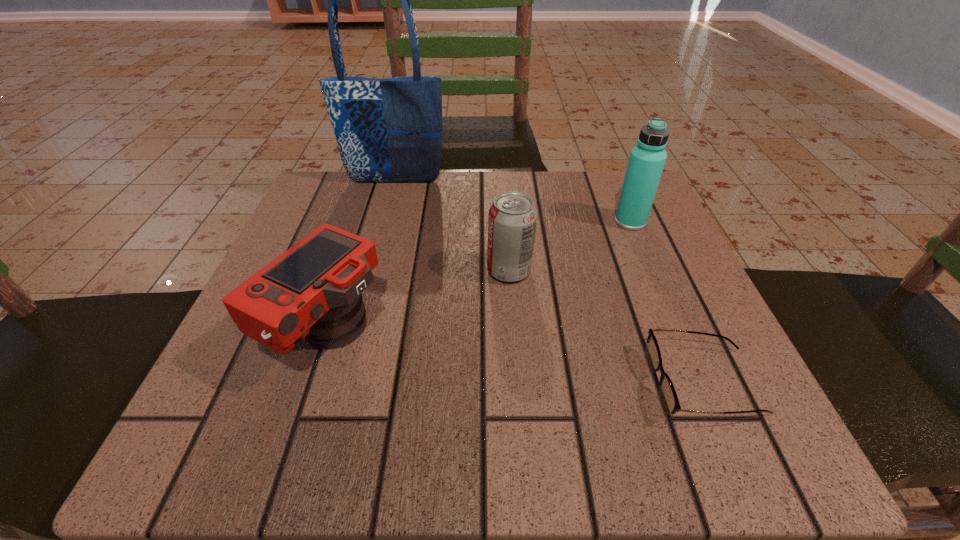
Find the location of a particular element. The image size is (960, 540). the farthest object is located at coordinates (388, 130).

In order to click on the tallest object in this screenshot , I will do `click(388, 130)`.

The width and height of the screenshot is (960, 540). Identify the location of the second farthest object. (647, 159).

The height and width of the screenshot is (540, 960). What are the coordinates of `thermos bottle` in the screenshot? It's located at (647, 159).

Image resolution: width=960 pixels, height=540 pixels. Identify the location of soda can. (512, 219).

You are a GUI agent. You are given a task and a screenshot of the screen. Output one action in this format:
    pyautogui.click(x=<x>, y=<y>)
    Task: Click on the third object from right to left
    This screenshot has height=540, width=960.
    Given the screenshot: What is the action you would take?
    pyautogui.click(x=512, y=219)

You are a GUI agent. You are given a task and a screenshot of the screen. Output one action in this format:
    pyautogui.click(x=<x>, y=<y>)
    Task: Click on the camera
    
    Given the screenshot: What is the action you would take?
    pyautogui.click(x=313, y=290)

Locate an element on the screen. This screenshot has width=960, height=540. the shortest object is located at coordinates (668, 396).

Locate an element on the screen. The width and height of the screenshot is (960, 540). vacant position located 0.110m on the front-facing side of the farthest object is located at coordinates (386, 216).

Locate an element on the screen. blank space located 0.190m on the front of the fourth nearest object is located at coordinates (663, 300).